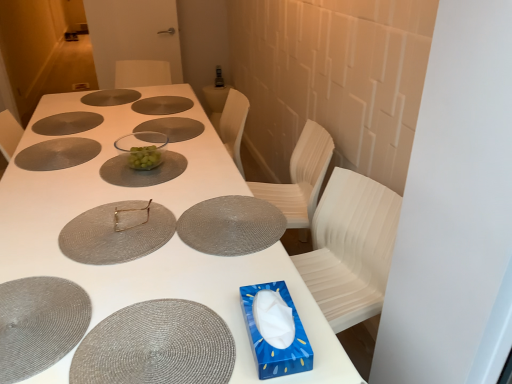
Find the location of a particular element. Image resolution: width=512 pixels, height=384 pixels. free space to the left of transparent glass bowl at center, acting as the 6th glass plate starting from the front is located at coordinates (101, 129).